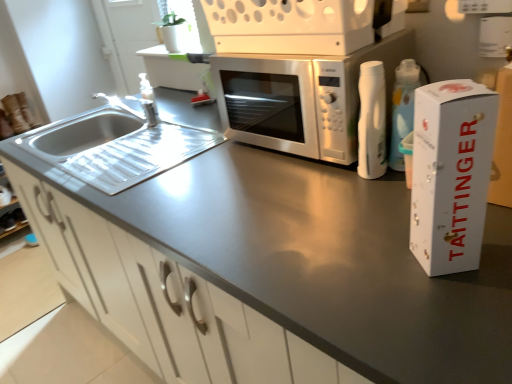
Question: Does satin silver microwave at center appear on the right side of satin silver microwave at center?

Choices:
 (A) no
 (B) yes

Answer: (B)

Question: Is satin silver microwave at center further to the viewer compared to satin silver microwave at center?

Choices:
 (A) yes
 (B) no

Answer: (A)

Question: Does satin silver microwave at center have a larger size compared to satin silver microwave at center?

Choices:
 (A) no
 (B) yes

Answer: (B)

Question: Is satin silver microwave at center positioned beyond the bounds of satin silver microwave at center?

Choices:
 (A) yes
 (B) no

Answer: (A)

Question: Would you say satin silver microwave at center is part of satin silver microwave at center's contents?

Choices:
 (A) yes
 (B) no

Answer: (B)

Question: Is satin silver microwave at center in front of or behind stainless steel sink at left in the image?

Choices:
 (A) behind
 (B) front

Answer: (B)

Question: Looking at the image, does satin silver microwave at center seem bigger or smaller compared to stainless steel sink at left?

Choices:
 (A) big
 (B) small

Answer: (B)

Question: Does point (385, 4) appear closer or farther from the camera than point (103, 109)?

Choices:
 (A) farther
 (B) closer

Answer: (B)

Question: Is satin silver microwave at center inside or outside of stainless steel sink at left?

Choices:
 (A) outside
 (B) inside

Answer: (A)

Question: Would you say stainless steel sink at left is to the left or to the right of white cardboard box at right in the picture?

Choices:
 (A) left
 (B) right

Answer: (A)

Question: In the image, is stainless steel sink at left positioned in front of or behind white cardboard box at right?

Choices:
 (A) behind
 (B) front

Answer: (A)

Question: Is point (117, 120) closer or farther from the camera than point (448, 205)?

Choices:
 (A) farther
 (B) closer

Answer: (A)

Question: Based on their sizes in the image, would you say stainless steel sink at left is bigger or smaller than white cardboard box at right?

Choices:
 (A) big
 (B) small

Answer: (A)

Question: From a real-world perspective, relative to satin silver microwave at center, is satin silver microwave at center vertically above or below?

Choices:
 (A) below
 (B) above

Answer: (B)

Question: Considering the positions of point (387, 8) and point (251, 127), is point (387, 8) closer or farther from the camera than point (251, 127)?

Choices:
 (A) farther
 (B) closer

Answer: (B)